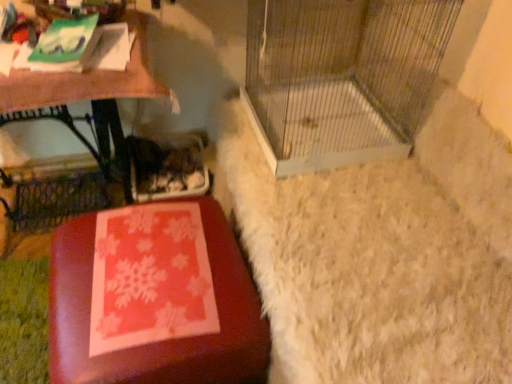
Question: From the image's perspective, is matte red ottoman at lower left beneath metal wire birdcage at center?

Choices:
 (A) yes
 (B) no

Answer: (A)

Question: Considering the relative sizes of matte red ottoman at lower left and metal wire birdcage at center in the image provided, is matte red ottoman at lower left wider than metal wire birdcage at center?

Choices:
 (A) yes
 (B) no

Answer: (B)

Question: Is matte red ottoman at lower left positioned with its back to metal wire birdcage at center?

Choices:
 (A) no
 (B) yes

Answer: (A)

Question: From the image's perspective, is matte red ottoman at lower left on metal wire birdcage at center?

Choices:
 (A) yes
 (B) no

Answer: (B)

Question: Can you confirm if matte red ottoman at lower left is taller than metal wire birdcage at center?

Choices:
 (A) no
 (B) yes

Answer: (A)

Question: From the image's perspective, relative to wooden table at left, is matte red ottoman at lower left above or below?

Choices:
 (A) above
 (B) below

Answer: (B)

Question: Relative to wooden table at left, is matte red ottoman at lower left in front or behind?

Choices:
 (A) behind
 (B) front

Answer: (B)

Question: From a real-world perspective, is matte red ottoman at lower left physically located above or below wooden table at left?

Choices:
 (A) above
 (B) below

Answer: (B)

Question: Based on their positions, is matte red ottoman at lower left located to the left or right of wooden table at left?

Choices:
 (A) right
 (B) left

Answer: (A)

Question: From a real-world perspective, is matte red ottoman at lower left physically located above or below metal wire birdcage at center?

Choices:
 (A) below
 (B) above

Answer: (A)

Question: Relative to metal wire birdcage at center, is matte red ottoman at lower left in front or behind?

Choices:
 (A) behind
 (B) front

Answer: (B)

Question: Do you think matte red ottoman at lower left is within metal wire birdcage at center, or outside of it?

Choices:
 (A) inside
 (B) outside

Answer: (B)

Question: Considering the relative positions of matte red ottoman at lower left and metal wire birdcage at center in the image provided, is matte red ottoman at lower left to the left or to the right of metal wire birdcage at center?

Choices:
 (A) left
 (B) right

Answer: (A)

Question: In terms of size, does metal wire birdcage at center appear bigger or smaller than wooden table at left?

Choices:
 (A) small
 (B) big

Answer: (A)

Question: In the image, is metal wire birdcage at center positioned in front of or behind wooden table at left?

Choices:
 (A) front
 (B) behind

Answer: (A)